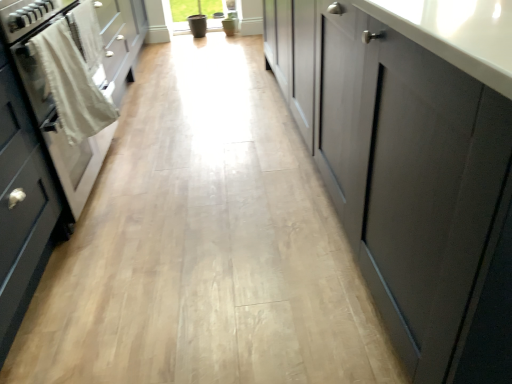
Question: Is white cotton towel at left at the right side of white glossy oven at left?

Choices:
 (A) no
 (B) yes

Answer: (B)

Question: Is white cotton towel at left taller than white glossy oven at left?

Choices:
 (A) no
 (B) yes

Answer: (A)

Question: Does white cotton towel at left come in front of white glossy oven at left?

Choices:
 (A) yes
 (B) no

Answer: (B)

Question: From the image's perspective, is white cotton towel at left under white glossy oven at left?

Choices:
 (A) yes
 (B) no

Answer: (B)

Question: From the image's perspective, is white cotton towel at left above white glossy oven at left?

Choices:
 (A) yes
 (B) no

Answer: (A)

Question: Would you say white cotton towel at left is outside white glossy oven at left?

Choices:
 (A) yes
 (B) no

Answer: (B)

Question: Can white glossy oven at left be found inside matte gray cabinet at center, the 1th cabinetry in the right-to-left sequence?

Choices:
 (A) no
 (B) yes

Answer: (A)

Question: Considering the relative sizes of matte gray cabinet at center, the second cabinetry from the left, and white glossy oven at left in the image provided, is matte gray cabinet at center, the second cabinetry from the left, shorter than white glossy oven at left?

Choices:
 (A) no
 (B) yes

Answer: (A)

Question: From a real-world perspective, is matte gray cabinet at center, the 1th cabinetry in the right-to-left sequence, physically above white glossy oven at left?

Choices:
 (A) yes
 (B) no

Answer: (A)

Question: Is matte gray cabinet at center, the second cabinetry from the left, bigger than white glossy oven at left?

Choices:
 (A) yes
 (B) no

Answer: (A)

Question: From the image's perspective, is matte gray cabinet at center, the second cabinetry from the left, located above white glossy oven at left?

Choices:
 (A) no
 (B) yes

Answer: (B)

Question: Considering the relative positions of matte gray cabinet at center, the second cabinetry from the left, and white glossy oven at left in the image provided, is matte gray cabinet at center, the second cabinetry from the left, in front of white glossy oven at left?

Choices:
 (A) yes
 (B) no

Answer: (A)

Question: Could you tell me if matte gray cabinet at left, which is the 2th cabinetry in right-to-left order, is turned towards white cotton towel at left?

Choices:
 (A) no
 (B) yes

Answer: (A)